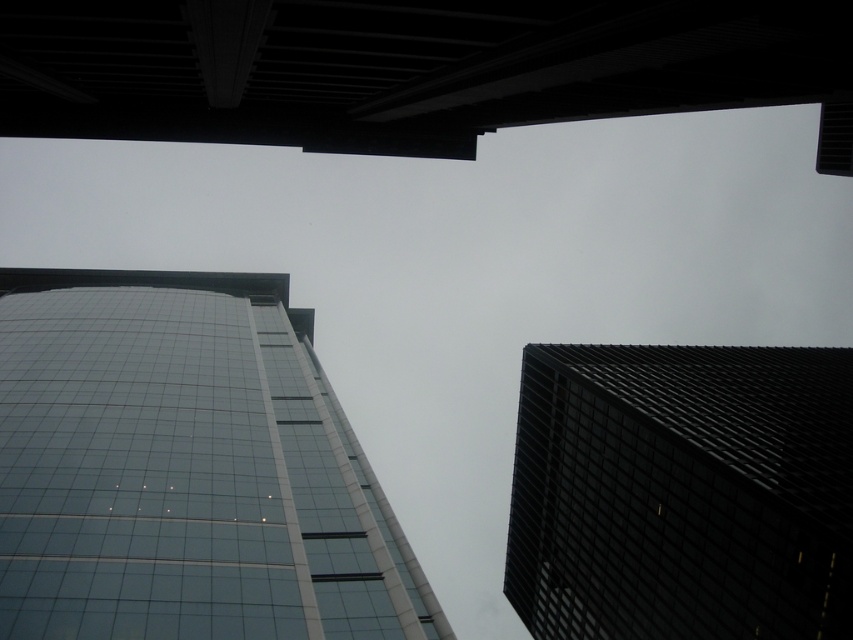
You are an architect analyzing the image. Based on the scene, which of the two buildings, the glassy reflective building at center or the black textured building at right, appears taller from this perspective?

The black textured building at right appears taller than the glassy reflective building at center based on the perspective shown.

You are standing on the street below and want to take a photo of both the glassy reflective building at center and the black textured building at right. Which building should you point your camera towards first to ensure both are in the frame?

You should point your camera towards the glassy reflective building at center first because it is closer to the viewer than the black textured building at right, so adjusting the camera angle to include both would require starting with the closer one.

You are standing at the base of the glassy reflective building at center. You want to throw a small ball straight up into the air. If the ball reaches a maximum height of 10 meters, will it hit the building?

The glassy reflective building at center is 29.25 meters away from the viewer. Since the ball only reaches 10 meters high, it won